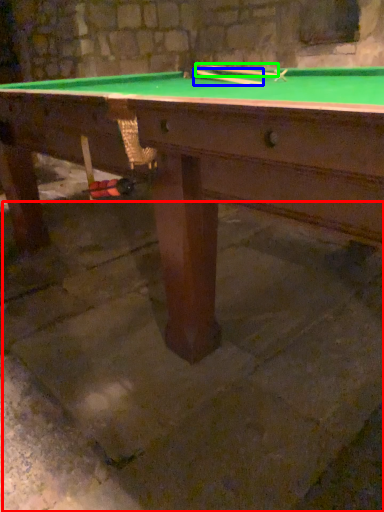
Question: Which is farther away from concrete (highlighted by a red box)? cue (highlighted by a blue box) or cue (highlighted by a green box)?

Choices:
 (A) cue
 (B) cue

Answer: (B)